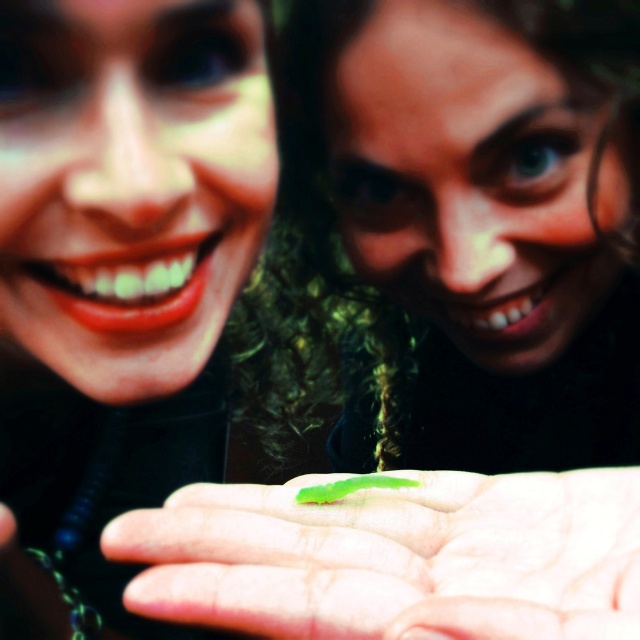
Question: Which point is farther to the camera?

Choices:
 (A) green rubber worm at center
 (B) green matte caterpillar at center

Answer: (B)

Question: In this image, where is green rubber worm at center located relative to green matte caterpillar at center?

Choices:
 (A) below
 (B) above

Answer: (A)

Question: Can you confirm if green rubber worm at center is positioned below green matte caterpillar at center?

Choices:
 (A) yes
 (B) no

Answer: (A)

Question: Is green rubber worm at center wider than green matte caterpillar at center?

Choices:
 (A) no
 (B) yes

Answer: (B)